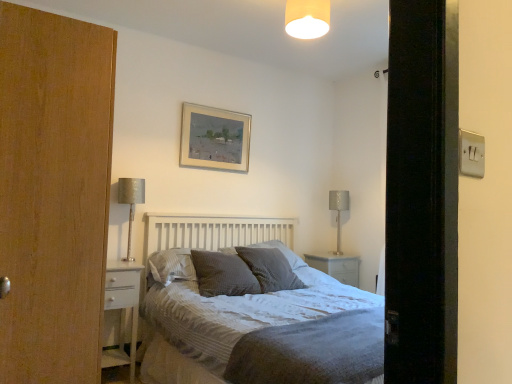
Question: Should I look upward or downward to see white wood bed at center?

Choices:
 (A) up
 (B) down

Answer: (B)

Question: Is textured gray pillow at center, arranged as the 4th pillow when viewed from the left, positioned with its back to satin silver table lamp at right, acting as the first table lamp starting from the right?

Choices:
 (A) yes
 (B) no

Answer: (B)

Question: From the image's perspective, is textured gray pillow at center, arranged as the 4th pillow when viewed from the left, under satin silver table lamp at right, marked as the 1th table lamp in a back-to-front arrangement?

Choices:
 (A) yes
 (B) no

Answer: (A)

Question: Considering the relative sizes of textured gray pillow at center, the 1th pillow when ordered from right to left, and satin silver table lamp at right, marked as the 1th table lamp in a back-to-front arrangement, in the image provided, is textured gray pillow at center, the 1th pillow when ordered from right to left, taller than satin silver table lamp at right, marked as the 1th table lamp in a back-to-front arrangement,?

Choices:
 (A) no
 (B) yes

Answer: (A)

Question: Is textured gray pillow at center, arranged as the 4th pillow when viewed from the left, placed right next to satin silver table lamp at right, which is the 2th table lamp from front to back?

Choices:
 (A) no
 (B) yes

Answer: (A)

Question: Does textured gray pillow at center, arranged as the 4th pillow when viewed from the left, have a lesser width compared to satin silver table lamp at right, which is the 2th table lamp from front to back?

Choices:
 (A) no
 (B) yes

Answer: (A)

Question: Are textured gray pillow at center, the 1th pillow when ordered from right to left, and satin silver table lamp at right, marked as the 1th table lamp in a back-to-front arrangement, far apart?

Choices:
 (A) no
 (B) yes

Answer: (B)

Question: Is textured grey pillow at center, which is the second pillow from right to left, turned away from white wood bed at center?

Choices:
 (A) yes
 (B) no

Answer: (A)

Question: Would you say textured grey pillow at center, which is counted as the third pillow, starting from the left, contains white wood bed at center?

Choices:
 (A) yes
 (B) no

Answer: (B)

Question: Is textured grey pillow at center, which is the second pillow from right to left, at the left side of white wood bed at center?

Choices:
 (A) yes
 (B) no

Answer: (A)

Question: Is textured grey pillow at center, which is counted as the third pillow, starting from the left, smaller than white wood bed at center?

Choices:
 (A) yes
 (B) no

Answer: (A)

Question: Is textured grey pillow at center, which is the second pillow from right to left, to the right of white wood bed at center from the viewer's perspective?

Choices:
 (A) yes
 (B) no

Answer: (B)

Question: From a real-world perspective, is dark grey textured pillow at center, which is counted as the 4th pillow, starting from the right, positioned over white glossy nightstand at lower left based on gravity?

Choices:
 (A) no
 (B) yes

Answer: (B)